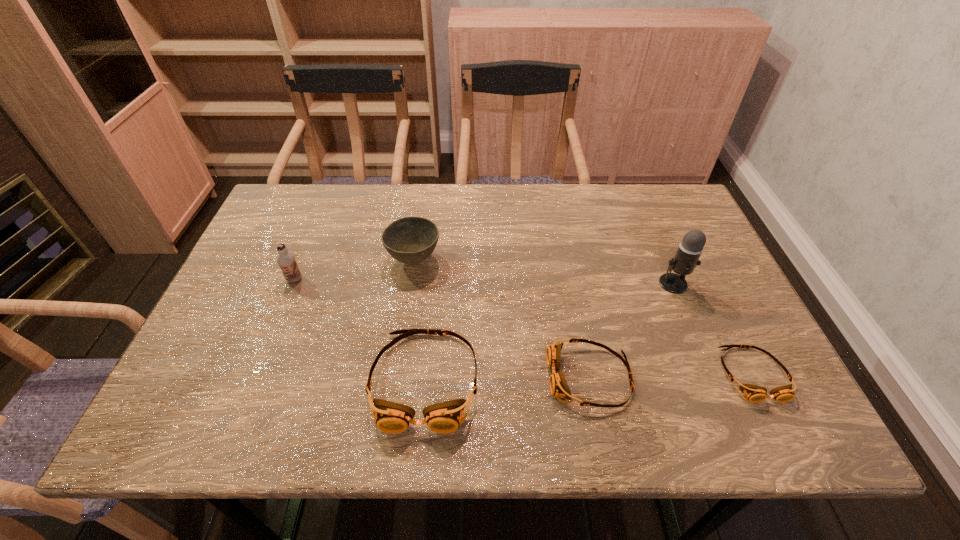
Please point a spot to add another goggles on the left. Please provide its 2D coordinates. Your answer should be formatted as a tuple, i.e. [(x, y)], where the tuple contains the x and y coordinates of a point satisfying the conditions above.

[(259, 383)]